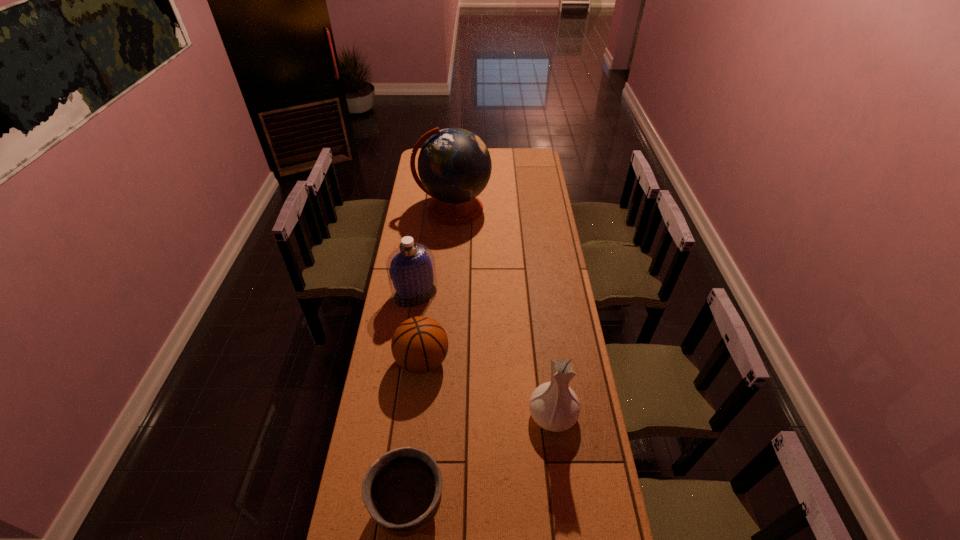
You are a GUI agent. You are given a task and a screenshot of the screen. Output one action in this format:
    pyautogui.click(x=<x>, y=<y>)
    Task: Click on the vacant space located on the back of the basketball
    This screenshot has height=540, width=960.
    Given the screenshot: What is the action you would take?
    tap(428, 307)

The image size is (960, 540). Identify the location of globe located in the left edge section of the desktop. (454, 165).

I want to click on cleansing agent that is at the left edge, so click(x=411, y=271).

Locate an element on the screen. The image size is (960, 540). basketball located in the left edge section of the desktop is located at coordinates (419, 345).

Locate an element on the screen. The width and height of the screenshot is (960, 540). object that is positioned at the right edge is located at coordinates [x=554, y=406].

Where is `vacant space at the right edge`? This screenshot has height=540, width=960. vacant space at the right edge is located at coordinates (548, 197).

Find the location of a particular element. This screenshot has height=540, width=960. free space at the far right corner of the desktop is located at coordinates (526, 157).

Locate an element on the screen. This screenshot has height=540, width=960. vacant space that's between the vase and the cleansing agent is located at coordinates (484, 354).

Locate an element on the screen. Image resolution: width=960 pixels, height=540 pixels. blank region between the globe and the fourth farthest object is located at coordinates (503, 312).

Locate an element on the screen. The height and width of the screenshot is (540, 960). free space between the rightmost object and the third farthest object is located at coordinates (488, 388).